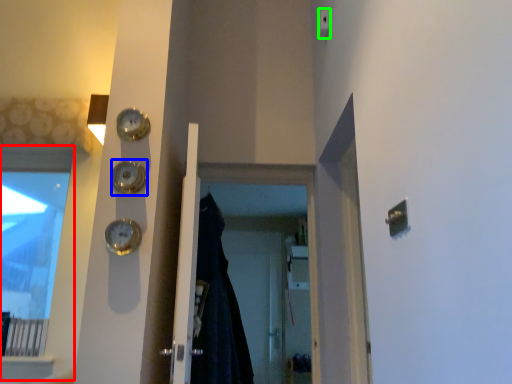
Question: Which object is positioned closest to window (highlighted by a red box)? Select from clock (highlighted by a blue box) and light switch (highlighted by a green box).

Choices:
 (A) clock
 (B) light switch

Answer: (A)